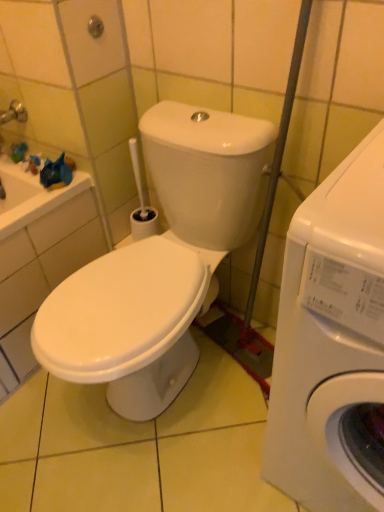
Question: From the image's perspective, is green rubber shower at upper left on top of white glossy washing machine at right, positioned as the 1th washing machine in left-to-right order?

Choices:
 (A) no
 (B) yes

Answer: (B)

Question: Considering the relative sizes of green rubber shower at upper left and white glossy washing machine at right, arranged as the second washing machine when viewed from the right, in the image provided, is green rubber shower at upper left smaller than white glossy washing machine at right, arranged as the second washing machine when viewed from the right,?

Choices:
 (A) no
 (B) yes

Answer: (B)

Question: From the image's perspective, does green rubber shower at upper left appear lower than white glossy washing machine at right, arranged as the second washing machine when viewed from the right?

Choices:
 (A) yes
 (B) no

Answer: (B)

Question: Is green rubber shower at upper left oriented away from white glossy washing machine at right, arranged as the second washing machine when viewed from the right?

Choices:
 (A) yes
 (B) no

Answer: (B)

Question: Is green rubber shower at upper left placed right next to white glossy washing machine at right, arranged as the second washing machine when viewed from the right?

Choices:
 (A) yes
 (B) no

Answer: (B)

Question: From a real-world perspective, does green rubber shower at upper left stand above white glossy washing machine at right, positioned as the 1th washing machine in left-to-right order?

Choices:
 (A) no
 (B) yes

Answer: (B)

Question: Does green rubber shower at upper left come behind white glossy washing machine at right, which is counted as the 1th washing machine, starting from the right?

Choices:
 (A) yes
 (B) no

Answer: (A)

Question: Is green rubber shower at upper left smaller than white glossy washing machine at right, which ranks as the second washing machine in left-to-right order?

Choices:
 (A) no
 (B) yes

Answer: (B)

Question: From the image's perspective, is green rubber shower at upper left located beneath white glossy washing machine at right, which is counted as the 1th washing machine, starting from the right?

Choices:
 (A) no
 (B) yes

Answer: (A)

Question: Is green rubber shower at upper left not near white glossy washing machine at right, which is counted as the 1th washing machine, starting from the right?

Choices:
 (A) yes
 (B) no

Answer: (B)

Question: Is green rubber shower at upper left aimed at white glossy washing machine at right, which ranks as the second washing machine in left-to-right order?

Choices:
 (A) no
 (B) yes

Answer: (A)

Question: Does green rubber shower at upper left have a lesser width compared to white glossy washing machine at right, which is counted as the 1th washing machine, starting from the right?

Choices:
 (A) no
 (B) yes

Answer: (B)

Question: Is white glossy washing machine at right, positioned as the 1th washing machine in left-to-right order, looking in the opposite direction of green rubber shower at upper left?

Choices:
 (A) yes
 (B) no

Answer: (B)